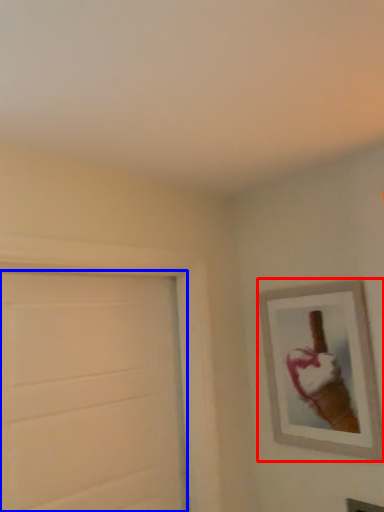
Question: Which point is further to the camera, picture frame (highlighted by a red box) or door (highlighted by a blue box)?

Choices:
 (A) picture frame
 (B) door

Answer: (A)